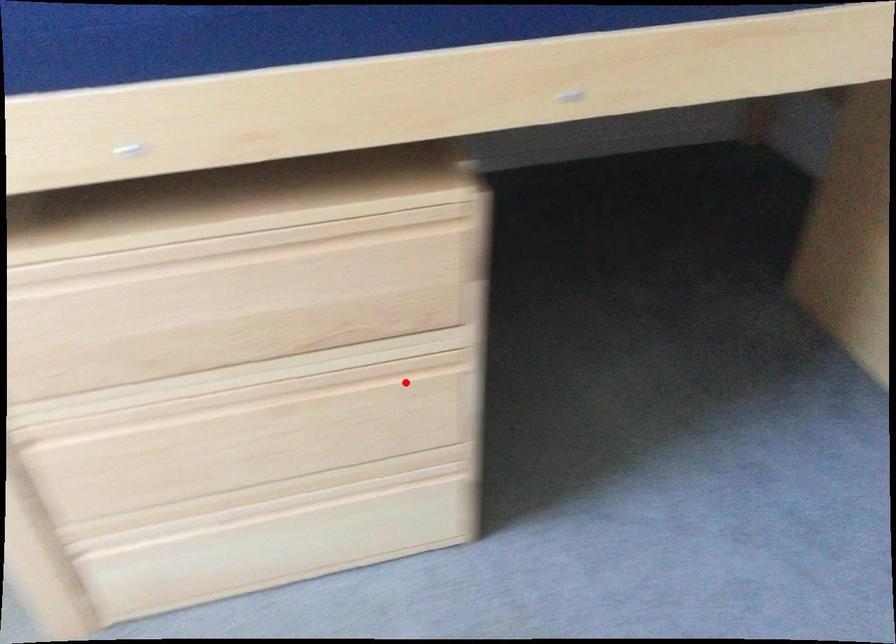
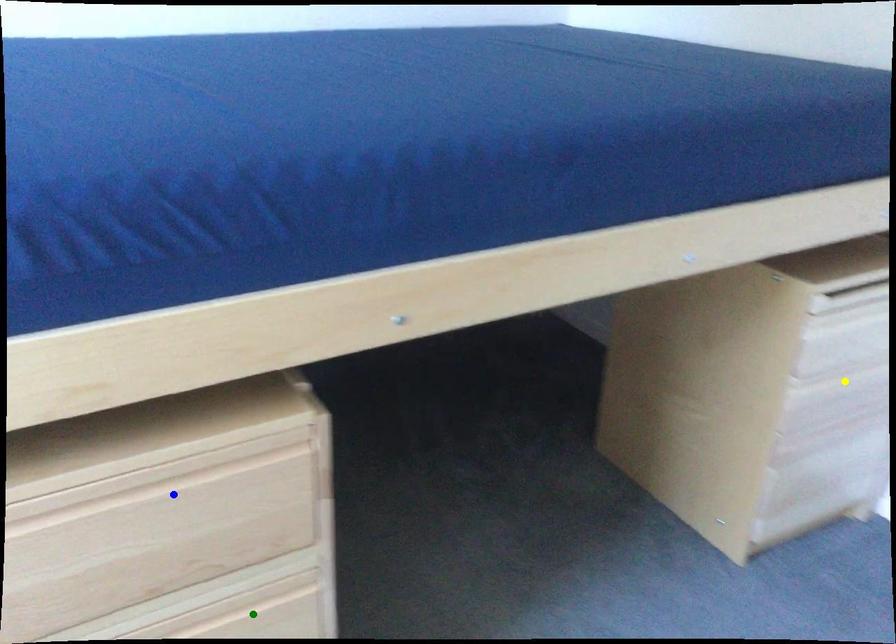
Question: I am providing you with two images of the same scene from different viewpoints. A red point is marked on the first image. You are given multiple points on the second image. Which point in image 2 represents the same 3d spot as the red point in image 1?

Choices:
 (A) blue point
 (B) yellow point
 (C) green point

Answer: (C)